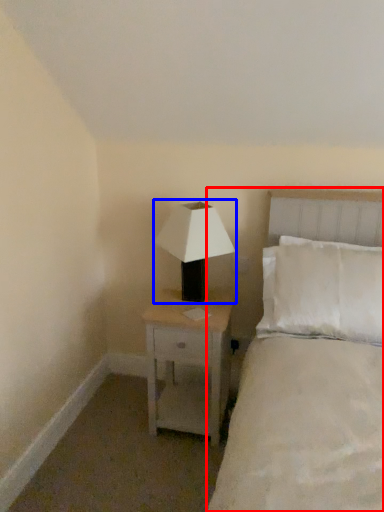
Question: Which point is closer to the camera, bed (highlighted by a red box) or lamp (highlighted by a blue box)?

Choices:
 (A) bed
 (B) lamp

Answer: (A)